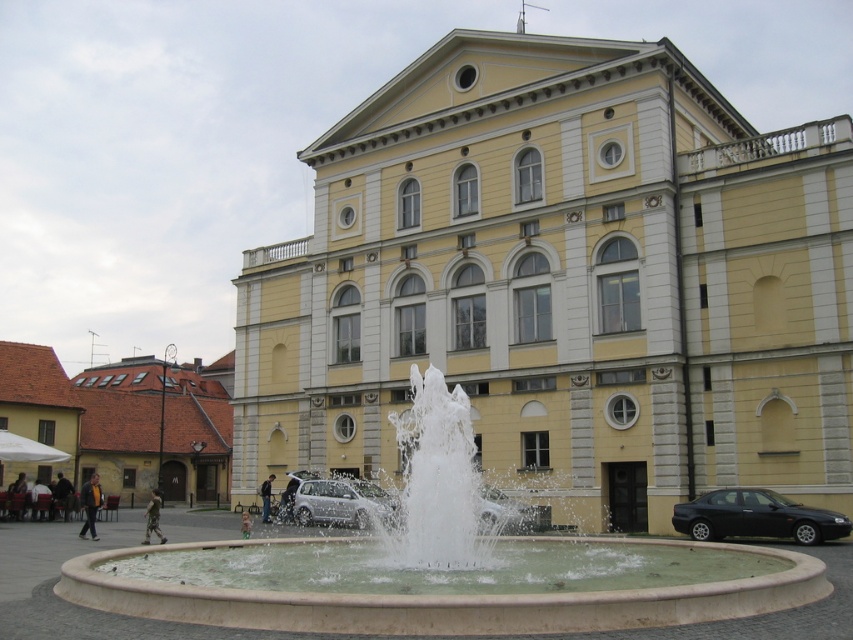
You are a delivery person needing to park your 2.5 meter wide van. You see the silver metallic hatchback at center and the yellow fabric jacket at lower left in the scene. Which parking spot between these two objects would be suitable for your van?

The yellow fabric jacket at lower left has a greater width than the silver metallic hatchback at center, so the parking spot near the yellow fabric jacket at lower left can accommodate your 2.5 meter wide van.

From the picture: You are standing at the entrance of the building and want to park your car in the parking lot behind the fountain. The parking lot has a designated parking spot at point 0.786, 0.402. Is the silver metallic hatchback at center currently occupying that parking spot?

The silver metallic hatchback at center is positioned at point (341, 502), so yes, it is occupying the designated parking spot at that location.